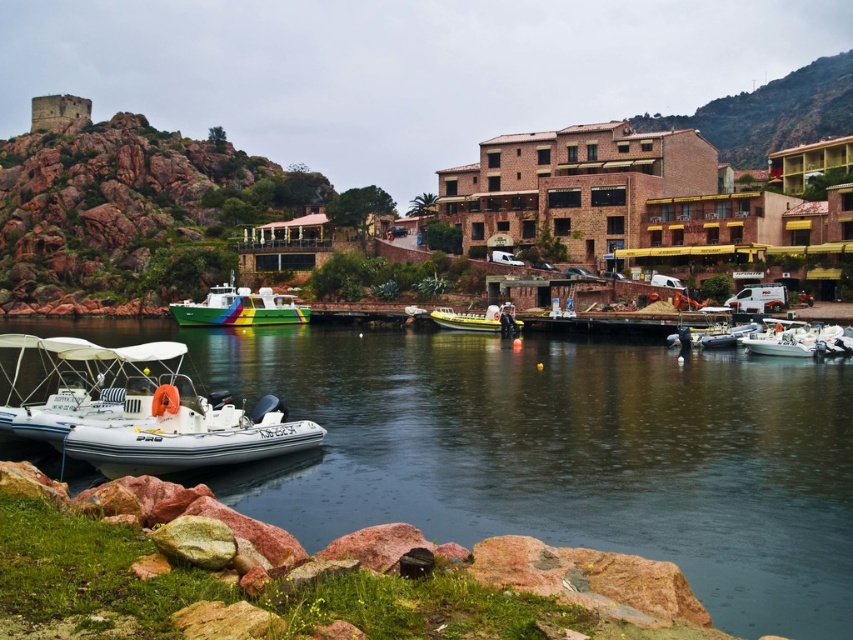
Between green rubber boat at center and white glossy boat at lower right, which one appears on the left side from the viewer's perspective?

green rubber boat at center

Between point (198, 307) and point (799, 332), which one is positioned in front?

Point (799, 332) is in front.

This screenshot has height=640, width=853. What are the coordinates of `green rubber boat at center` in the screenshot? It's located at (239, 307).

Does clear water at lower center come in front of rustic stone tower at upper left?

Yes, clear water at lower center is in front of rustic stone tower at upper left.

Can you confirm if clear water at lower center is positioned below rustic stone tower at upper left?

Indeed, clear water at lower center is positioned under rustic stone tower at upper left.

Describe the element at coordinates (554, 452) in the screenshot. I see `clear water at lower center` at that location.

Find the location of a particular element. clear water at lower center is located at coordinates (554, 452).

Who is taller, clear water at lower center or yellow rubber boat at center?

clear water at lower center is taller.

Can you confirm if clear water at lower center is positioned to the left of yellow rubber boat at center?

Yes, clear water at lower center is to the left of yellow rubber boat at center.

In the scene shown: Measure the distance between clear water at lower center and camera.

clear water at lower center is 33.61 meters from camera.

Find the location of `clear water at lower center`. clear water at lower center is located at coordinates coord(554,452).